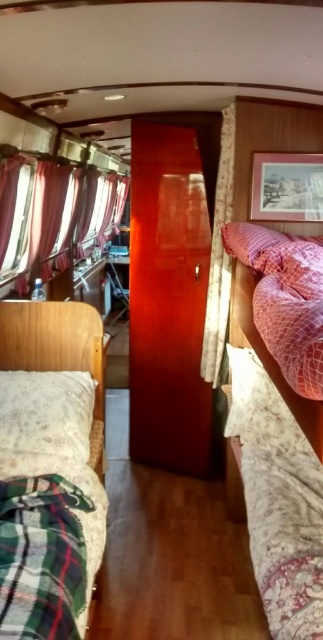
Question: From the image, what is the correct spatial relationship of fluffy pink bed at center in relation to velvet-like burgundy curtain at left?

Choices:
 (A) below
 (B) above

Answer: (A)

Question: Which object is closer to the camera taking this photo?

Choices:
 (A) pink mesh pillow at center
 (B) floral fabric curtain at center

Answer: (A)

Question: Is green plaid fabric at lower left below fluffy white bed at left?

Choices:
 (A) no
 (B) yes

Answer: (B)

Question: Which point appears farthest from the camera in this image?

Choices:
 (A) (4, 384)
 (B) (23, 353)

Answer: (B)

Question: From the image, what is the correct spatial relationship of green plaid fabric at lower left in relation to fluffy white bed at left?

Choices:
 (A) right
 (B) left

Answer: (A)

Question: Which point is farther from the camera taking this photo?

Choices:
 (A) (11, 467)
 (B) (59, 308)
 (C) (285, 243)
 (D) (278, 566)

Answer: (B)